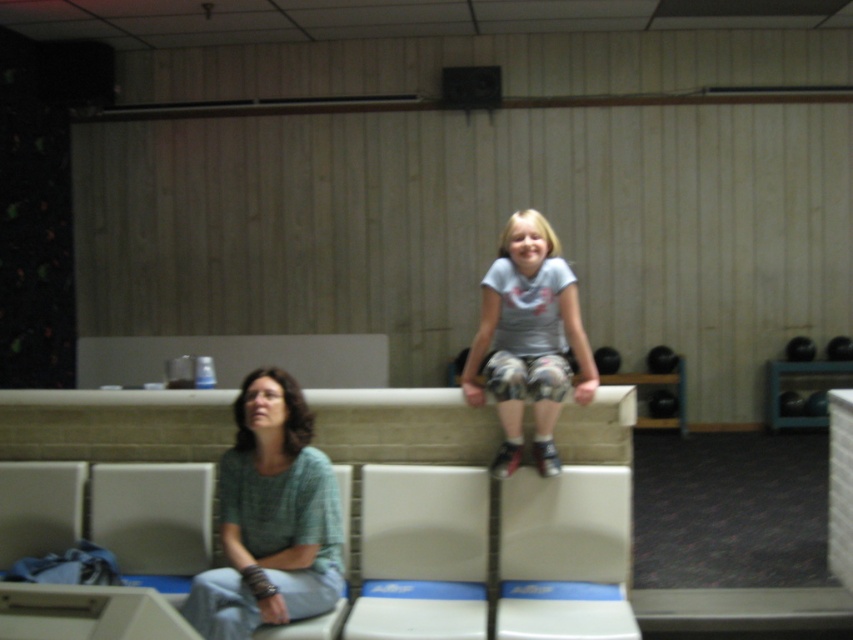
You are standing at the entrance of the bowling alley and want to sit on the wooden bench at upper center. According to the image, where should you walk to find it?

The wooden bench at upper center is located at point (114, 424), so walk towards that coordinate to find it.

Looking at this image, you are standing at the entrance of the bowling alley and want to find the green woven shirt at center. According to the coordinates provided, in which direction should you look to locate it?

The green woven shirt at center is located at coordinates point (271, 518), so you should look towards the lower right direction from your position at the entrance to locate it.